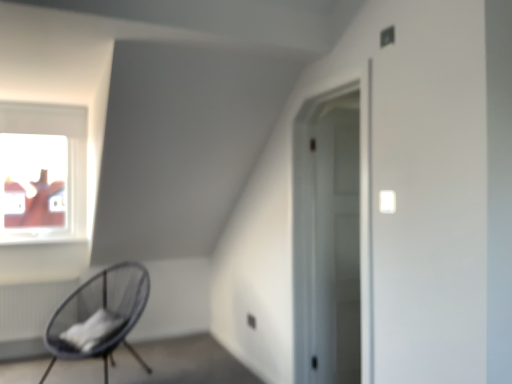
Question: From a real-world perspective, is white matte door at center beneath black mesh chair at lower left?

Choices:
 (A) yes
 (B) no

Answer: (B)

Question: Would you say white matte door at center is outside black mesh chair at lower left?

Choices:
 (A) yes
 (B) no

Answer: (A)

Question: Is white matte door at center far away from black mesh chair at lower left?

Choices:
 (A) no
 (B) yes

Answer: (B)

Question: Is white matte door at center further to the viewer compared to black mesh chair at lower left?

Choices:
 (A) no
 (B) yes

Answer: (B)

Question: Is white matte door at center taller than black mesh chair at lower left?

Choices:
 (A) no
 (B) yes

Answer: (B)

Question: From the image's perspective, is white matte door at center under black mesh chair at lower left?

Choices:
 (A) no
 (B) yes

Answer: (A)

Question: Considering the relative sizes of white textured radiator at lower left and black mesh chair at lower left in the image provided, is white textured radiator at lower left taller than black mesh chair at lower left?

Choices:
 (A) yes
 (B) no

Answer: (B)

Question: Is white textured radiator at lower left shorter than black mesh chair at lower left?

Choices:
 (A) yes
 (B) no

Answer: (A)

Question: Is white textured radiator at lower left behind black mesh chair at lower left?

Choices:
 (A) no
 (B) yes

Answer: (B)

Question: From a real-world perspective, is white textured radiator at lower left physically above black mesh chair at lower left?

Choices:
 (A) yes
 (B) no

Answer: (B)

Question: Does white textured radiator at lower left have a smaller size compared to black mesh chair at lower left?

Choices:
 (A) no
 (B) yes

Answer: (B)

Question: From the image's perspective, does white textured radiator at lower left appear higher than black mesh chair at lower left?

Choices:
 (A) no
 (B) yes

Answer: (A)

Question: Is white textured radiator at lower left wider than white matte door at center?

Choices:
 (A) yes
 (B) no

Answer: (A)